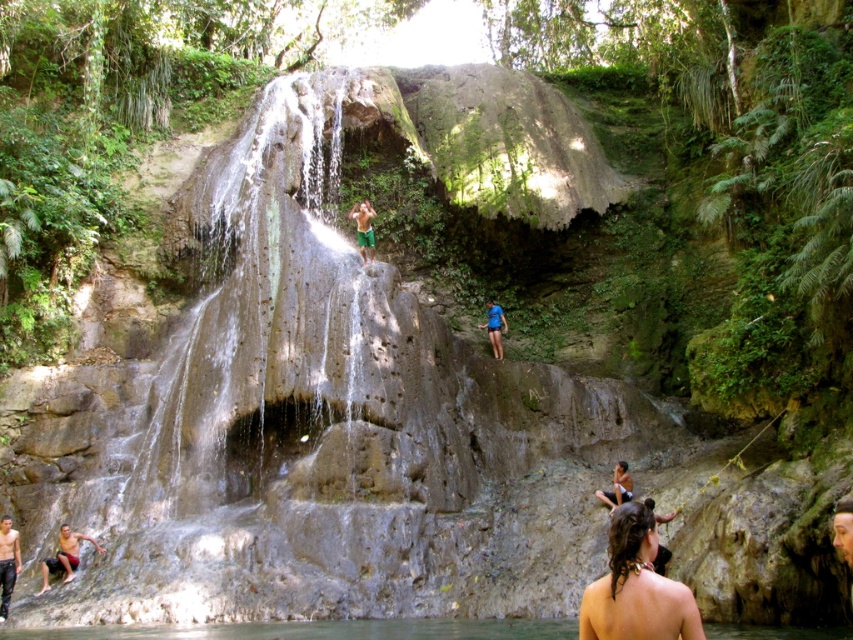
Question: Does brown hair at lower right have a larger size compared to smooth brown hair at lower right?

Choices:
 (A) no
 (B) yes

Answer: (B)

Question: Is brown hair at lower right to the right of smooth skin person at lower right from the viewer's perspective?

Choices:
 (A) no
 (B) yes

Answer: (A)

Question: Which point appears closest to the camera in this image?

Choices:
 (A) (595, 628)
 (B) (497, 356)

Answer: (A)

Question: Is gray stone waterfall at center to the left of brown hair at lower right from the viewer's perspective?

Choices:
 (A) no
 (B) yes

Answer: (B)

Question: Which point is farther to the camera?

Choices:
 (A) green matte shorts at center
 (B) blue fabric shorts at lower center
 (C) smooth skin person at lower right
 (D) clear water at bottom center

Answer: (B)

Question: Which point appears farthest from the camera in this image?

Choices:
 (A) pos(645,515)
 (B) pos(619,492)
 (C) pos(840,504)

Answer: (B)